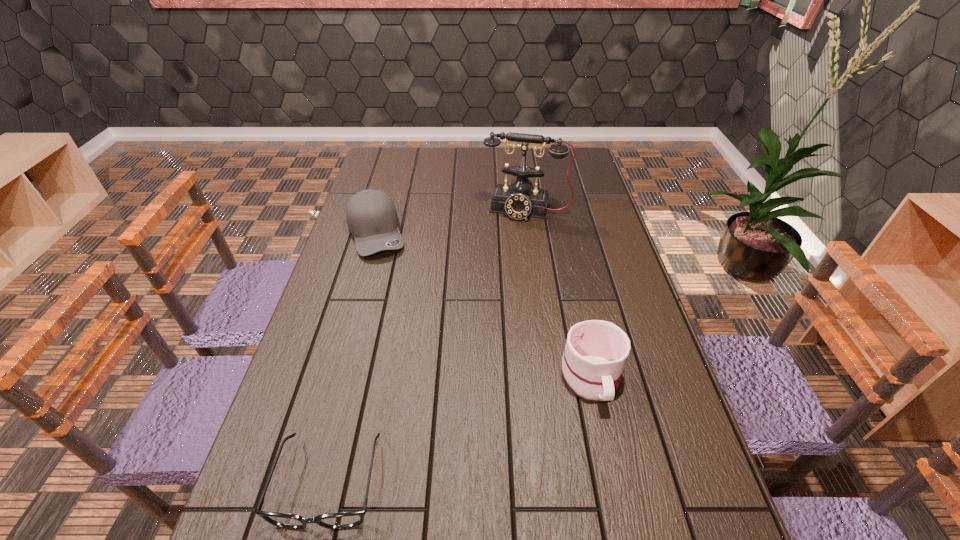
Where is `spectacles`? The image size is (960, 540). spectacles is located at coordinates (343, 520).

I want to click on the nearest object, so click(343, 520).

The height and width of the screenshot is (540, 960). Identify the location of the second nearest object. (596, 351).

The image size is (960, 540). I want to click on baseball cap, so click(x=371, y=216).

Identify the location of the tallest object. (520, 200).

The width and height of the screenshot is (960, 540). In order to click on free region located on the side with the handle of the third farthest object in this screenshot , I will do `click(624, 524)`.

Locate an element on the screen. vacant space located 0.300m on the front brim of the baseball cap is located at coordinates (406, 326).

This screenshot has width=960, height=540. I want to click on free space located 0.090m on the front brim of the baseball cap, so click(388, 277).

Identify the location of free location located on the front brim of the baseball cap. (399, 308).

Identify the location of vacant space located on the dial of the tallest object. (500, 294).